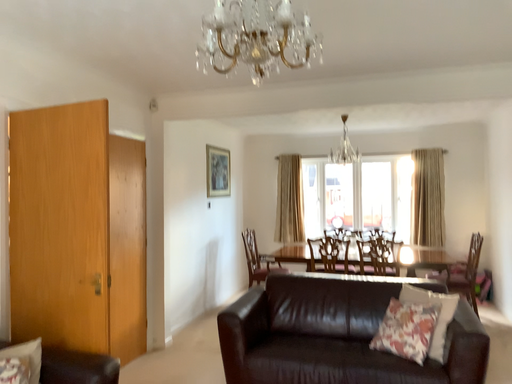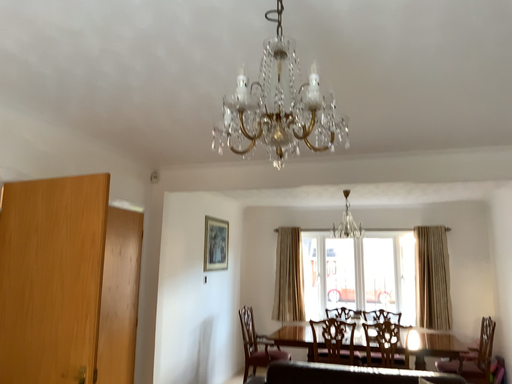
Question: How did the camera likely rotate when shooting the video?

Choices:
 (A) rotated downward
 (B) rotated upward

Answer: (B)